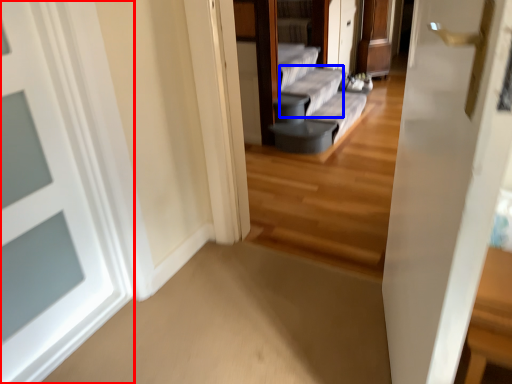
Question: Which object appears farthest to the camera in this image, door (highlighted by a red box) or couch (highlighted by a blue box)?

Choices:
 (A) door
 (B) couch

Answer: (B)